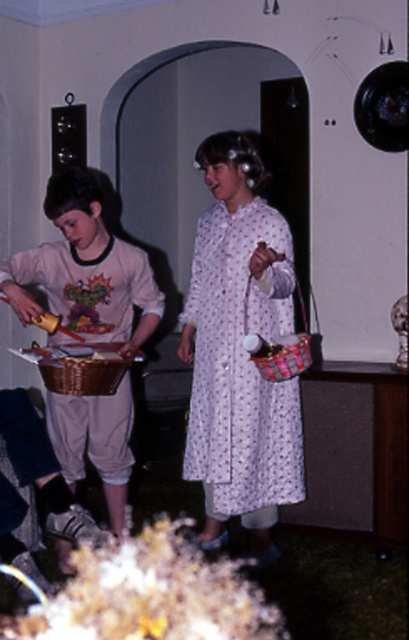
Can you confirm if white floral dress at center is wider than light pink cotton dress at center?

No, white floral dress at center is not wider than light pink cotton dress at center.

Measure the distance between point (x=287, y=292) and camera.

Point (x=287, y=292) and camera are 3.04 meters apart.

Does point (247, 476) come behind point (22, 308)?

That is True.

Where is `white floral dress at center`? The width and height of the screenshot is (409, 640). white floral dress at center is located at coordinates (240, 365).